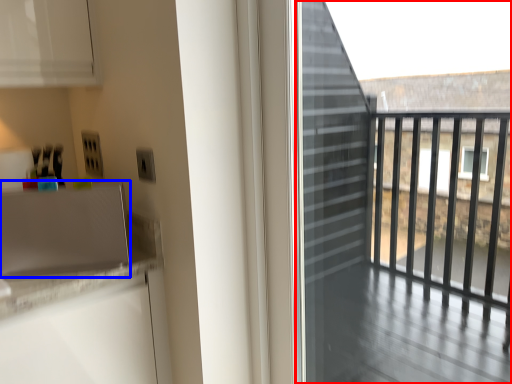
Question: Which object is closer to the camera taking this photo, screen door (highlighted by a red box) or appliance (highlighted by a blue box)?

Choices:
 (A) screen door
 (B) appliance

Answer: (A)